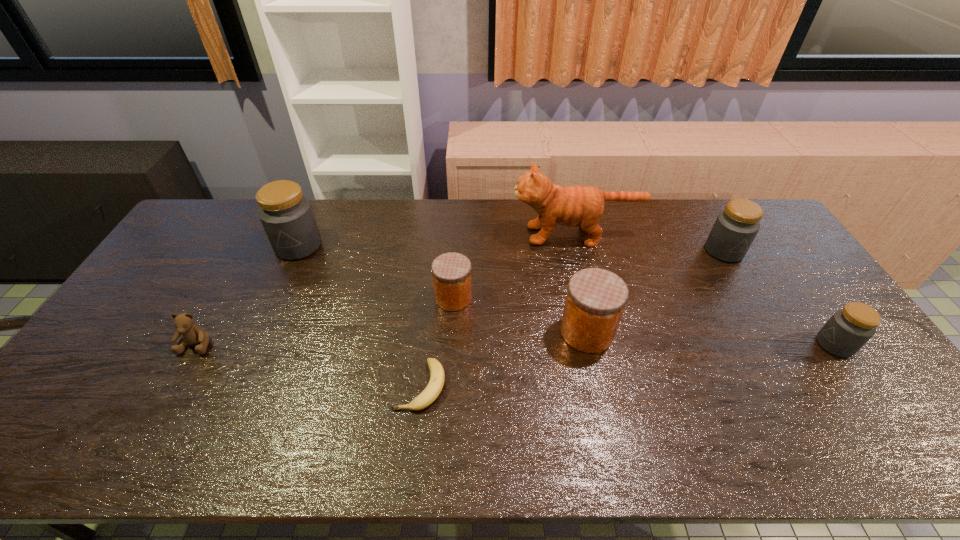
Locate an element on the screen. vacant space at the far edge of the desktop is located at coordinates (634, 203).

At what (x,y) coordinates should I click in order to perform the action: click on blank space at the near edge of the desktop. Please return your answer as a coordinate pair (x, y). This screenshot has width=960, height=540. Looking at the image, I should click on (592, 441).

Image resolution: width=960 pixels, height=540 pixels. In order to click on vacant space at the left edge of the desktop in this screenshot , I will do `click(140, 292)`.

This screenshot has width=960, height=540. In order to click on vacant position at the right edge of the desktop in this screenshot , I will do `click(822, 309)`.

Identify the location of vacant space at the near left corner of the desktop. (84, 461).

Where is `free region at the far right corner of the desktop`? The width and height of the screenshot is (960, 540). free region at the far right corner of the desktop is located at coordinates (773, 240).

This screenshot has height=540, width=960. I want to click on free spot between the fourth jar from left to right and the rightmost gray jar, so [780, 298].

What are the coordinates of `free space between the bigger orange jar and the nearest object` in the screenshot? It's located at click(x=503, y=359).

You are a GUI agent. You are given a task and a screenshot of the screen. Output one action in this format:
    pyautogui.click(x=<x>, y=<y>)
    Task: Click on the vacant area that lies between the smaller orange jar and the brown teddy bear
    The image size is (960, 540).
    Given the screenshot: What is the action you would take?
    pyautogui.click(x=325, y=321)

Find the location of a particular element. The image size is (960, 540). free spot between the left orange jar and the smallest gray jar is located at coordinates (644, 321).